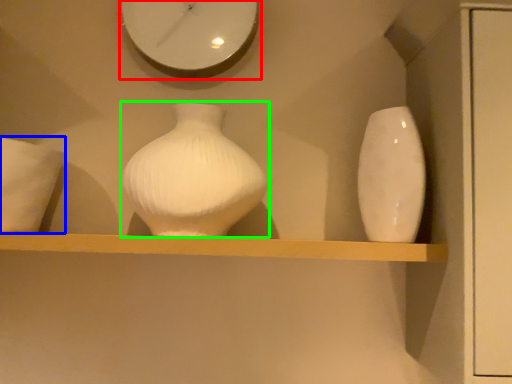
Question: Based on their relative distances, which object is farther from clock (highlighted by a red box)? Choose from pillow (highlighted by a blue box) and vase (highlighted by a green box).

Choices:
 (A) pillow
 (B) vase

Answer: (A)